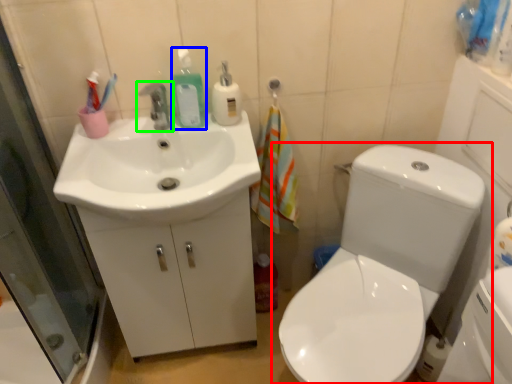
Question: Which is nearer to the toilet (highlighted by a red box)? cleaning product (highlighted by a blue box) or tap (highlighted by a green box).

Choices:
 (A) cleaning product
 (B) tap

Answer: (A)